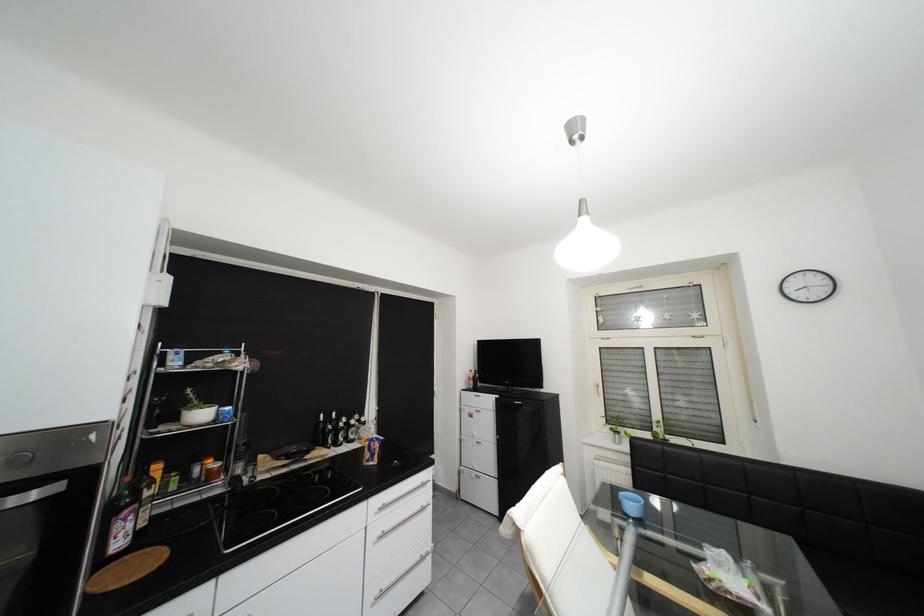
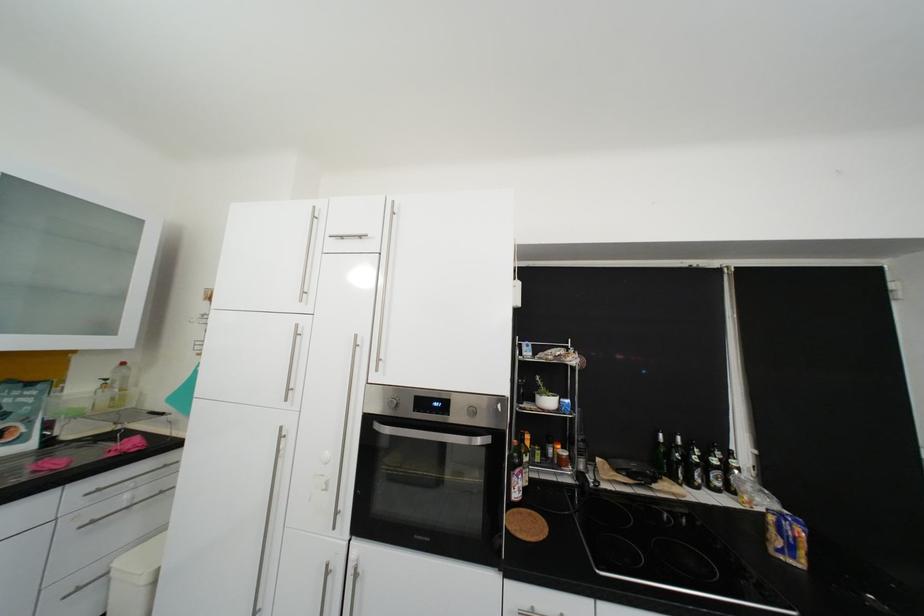
In the second image, find the point that corresponds to [347,445] in the first image.

(701, 485)